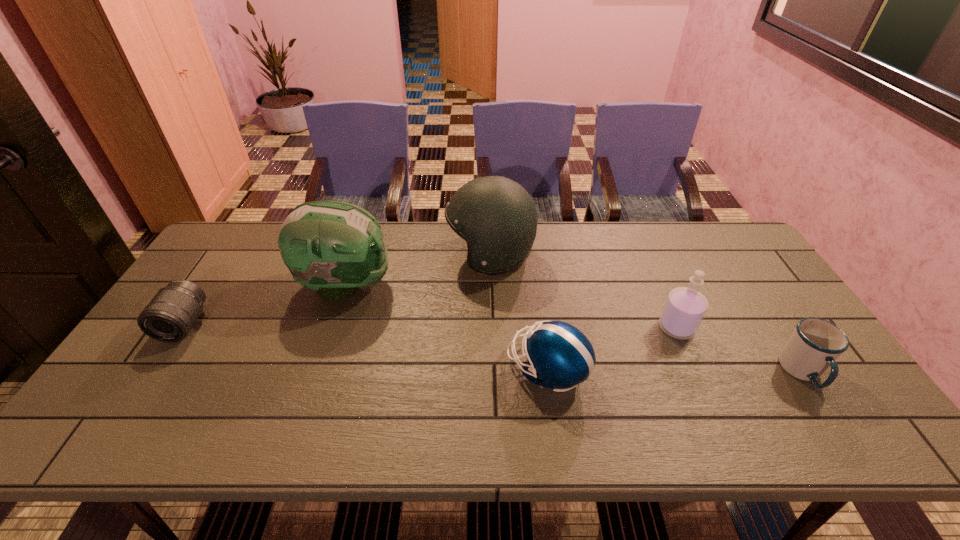
This screenshot has height=540, width=960. Find the location of `free space located at the front of the fourth tallest object with the faceguard`. free space located at the front of the fourth tallest object with the faceguard is located at coordinates (471, 369).

I want to click on vacant space located at the front of the fourth tallest object with the faceguard, so click(x=372, y=369).

Locate an element on the screen. The image size is (960, 540). free spot located 0.050m on the handle side of the mug is located at coordinates click(832, 417).

At what (x,y) coordinates should I click in order to perform the action: click on vacant space located 0.250m on the surface of the telephoto lens. Please return your answer as a coordinate pair (x, y). This screenshot has width=960, height=540. Looking at the image, I should click on (112, 433).

Find the location of a particular element. This screenshot has height=540, width=960. object that is at the left edge is located at coordinates (170, 315).

Identify the location of object that is at the right edge. (815, 344).

This screenshot has height=540, width=960. In the image, there is a desktop. Identify the location of vacant space at the far edge. (559, 261).

Locate an element on the screen. vacant region at the left edge is located at coordinates (169, 370).

Identify the location of vacant region at the right edge of the desktop. The image size is (960, 540). (739, 319).

In the image, there is a desktop. Where is `vacant space at the far left corner`? This screenshot has width=960, height=540. vacant space at the far left corner is located at coordinates (239, 224).